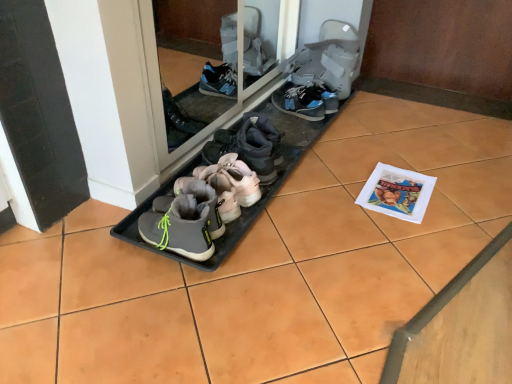
I want to click on blank space situated above white paper magazine at upper right (from a real-world perspective), so click(x=400, y=187).